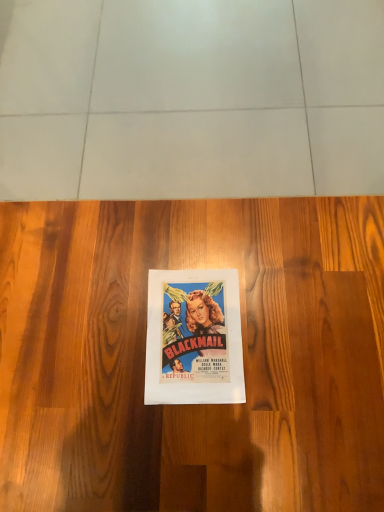
Measure the distance between matte paper poster at center and camera.

34.72 inches.

This screenshot has width=384, height=512. What do you see at coordinates (194, 338) in the screenshot?
I see `matte paper poster at center` at bounding box center [194, 338].

Locate an element on the screen. Image resolution: width=384 pixels, height=512 pixels. matte paper poster at center is located at coordinates (194, 338).

Describe the element at coordinates (144, 357) in the screenshot. The height and width of the screenshot is (512, 384). I see `wooden floor at center` at that location.

Identify the location of wooden floor at center. The image size is (384, 512). (144, 357).

Locate an element on the screen. The height and width of the screenshot is (512, 384). matte paper poster at center is located at coordinates (194, 338).

Considering the relative positions of matte paper poster at center and wooden floor at center in the image provided, is matte paper poster at center to the right of wooden floor at center from the viewer's perspective?

Correct, you'll find matte paper poster at center to the right of wooden floor at center.

Which object is closer to the camera taking this photo, matte paper poster at center or wooden floor at center?

wooden floor at center is more forward.

Is point (227, 365) closer or farther from the camera than point (329, 317)?

Point (227, 365) is closer to the camera than point (329, 317).

From the image's perspective, which one is positioned higher, matte paper poster at center or wooden floor at center?

wooden floor at center appears higher in the image.

From a real-world perspective, is matte paper poster at center physically below wooden floor at center?

No, from a real-world perspective, matte paper poster at center is not under wooden floor at center.

Based on the photo, which object is thinner, matte paper poster at center or wooden floor at center?

matte paper poster at center is thinner.

In terms of height, does matte paper poster at center look taller or shorter compared to wooden floor at center?

Considering their sizes, matte paper poster at center has less height than wooden floor at center.

Who is smaller, matte paper poster at center or wooden floor at center?

With smaller size is matte paper poster at center.

Do you think matte paper poster at center is within wooden floor at center, or outside of it?

matte paper poster at center can be found inside wooden floor at center.

Does matte paper poster at center touch wooden floor at center?

No.

Could you tell me if matte paper poster at center is turned towards wooden floor at center?

Yes.

How many degrees apart are the facing directions of matte paper poster at center and wooden floor at center?

They differ by 92.1 degrees in their facing directions.

Identify the location of hardwood located in front of the matte paper poster at center. The width and height of the screenshot is (384, 512). click(x=144, y=357).

Which is more to the right, wooden floor at center or matte paper poster at center?

From the viewer's perspective, matte paper poster at center appears more on the right side.

Who is more distant, wooden floor at center or matte paper poster at center?

Positioned behind is matte paper poster at center.

Does point (100, 326) appear closer or farther from the camera than point (166, 378)?

Point (100, 326) is positioned farther from the camera compared to point (166, 378).

From the image's perspective, is wooden floor at center below matte paper poster at center?

Incorrect, from the image's perspective, wooden floor at center is higher than matte paper poster at center.

From a real-world perspective, is wooden floor at center beneath matte paper poster at center?

Yes.

In terms of width, does wooden floor at center look wider or thinner when compared to matte paper poster at center?

In the image, wooden floor at center appears to be wider than matte paper poster at center.

Which of these two, wooden floor at center or matte paper poster at center, stands taller?

With more height is wooden floor at center.

Between wooden floor at center and matte paper poster at center, which one has larger size?

Bigger between the two is wooden floor at center.

Is wooden floor at center positioned beyond the bounds of matte paper poster at center?

wooden floor at center is positioned outside matte paper poster at center.

Is there a large distance between wooden floor at center and matte paper poster at center?

Actually, wooden floor at center and matte paper poster at center are a little close together.

Is matte paper poster at center at the back of wooden floor at center?

No.

The width and height of the screenshot is (384, 512). Find the location of `hardwood lying in front of the matte paper poster at center`. hardwood lying in front of the matte paper poster at center is located at coordinates (144, 357).

Identify the location of poster on the right of wooden floor at center. (194, 338).

At what (x,y) coordinates should I click in order to perform the action: click on poster lying below the wooden floor at center (from the image's perspective). Please return your answer as a coordinate pair (x, y). Image resolution: width=384 pixels, height=512 pixels. Looking at the image, I should click on pyautogui.click(x=194, y=338).